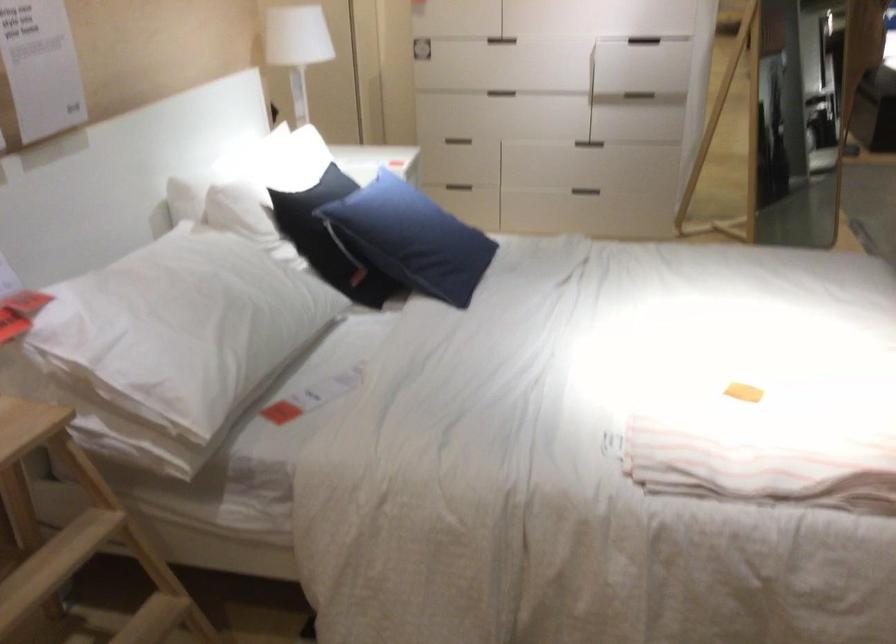
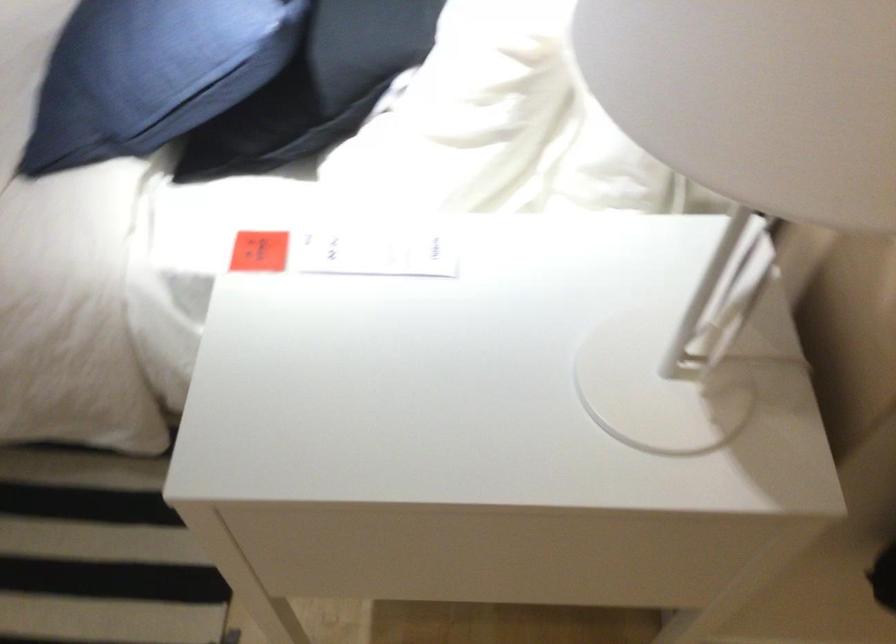
Find the pixel in the second image that matches point (375, 167) in the first image.

(375, 252)